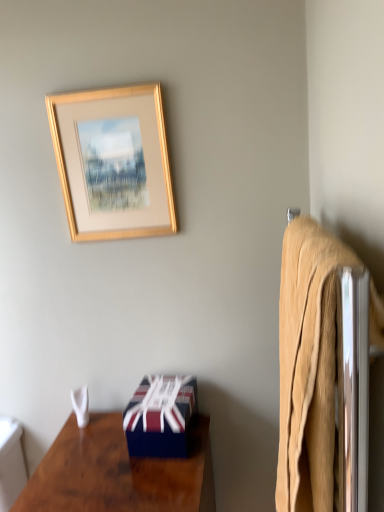
Question: Considering the relative sizes of shiny dark wood desk at lower left and beige cotton bath towel at right in the image provided, is shiny dark wood desk at lower left taller than beige cotton bath towel at right?

Choices:
 (A) no
 (B) yes

Answer: (A)

Question: From a real-world perspective, is shiny dark wood desk at lower left physically below beige cotton bath towel at right?

Choices:
 (A) no
 (B) yes

Answer: (B)

Question: From the image's perspective, does shiny dark wood desk at lower left appear higher than beige cotton bath towel at right?

Choices:
 (A) yes
 (B) no

Answer: (B)

Question: Is shiny dark wood desk at lower left to the right of beige cotton bath towel at right from the viewer's perspective?

Choices:
 (A) no
 (B) yes

Answer: (A)

Question: Is shiny dark wood desk at lower left to the left of beige cotton bath towel at right from the viewer's perspective?

Choices:
 (A) yes
 (B) no

Answer: (A)

Question: From the image's perspective, is white fabric towel at lower left above or below blue glossy box at lower center?

Choices:
 (A) below
 (B) above

Answer: (A)

Question: In the image, is white fabric towel at lower left positioned in front of or behind blue glossy box at lower center?

Choices:
 (A) behind
 (B) front

Answer: (A)

Question: Considering the positions of white fabric towel at lower left and blue glossy box at lower center in the image, is white fabric towel at lower left bigger or smaller than blue glossy box at lower center?

Choices:
 (A) small
 (B) big

Answer: (A)

Question: From a real-world perspective, is white fabric towel at lower left physically located above or below blue glossy box at lower center?

Choices:
 (A) above
 (B) below

Answer: (B)

Question: Is white fabric towel at lower left wider or thinner than gold wooden picture frame at upper center?

Choices:
 (A) thin
 (B) wide

Answer: (B)

Question: Is point (87, 394) closer or farther from the camera than point (155, 184)?

Choices:
 (A) closer
 (B) farther

Answer: (B)

Question: Would you say white fabric towel at lower left is to the left or to the right of gold wooden picture frame at upper center in the picture?

Choices:
 (A) right
 (B) left

Answer: (B)

Question: In terms of size, does white fabric towel at lower left appear bigger or smaller than gold wooden picture frame at upper center?

Choices:
 (A) big
 (B) small

Answer: (B)

Question: Considering the relative positions of beige cotton bath towel at right and gold wooden picture frame at upper center in the image provided, is beige cotton bath towel at right to the left or to the right of gold wooden picture frame at upper center?

Choices:
 (A) left
 (B) right

Answer: (B)

Question: In terms of width, does beige cotton bath towel at right look wider or thinner when compared to gold wooden picture frame at upper center?

Choices:
 (A) thin
 (B) wide

Answer: (A)